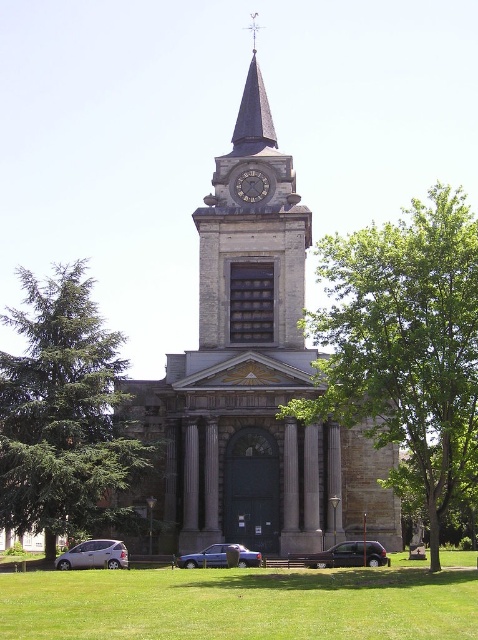
Consider the image. You are standing in front of the church and notice two points marked on the tower. Which point, point (377, 541) or point (241, 550), is closer to you?

Point (377, 541) is closer to you because it is further to the viewer than point (241, 550).

You are standing in front of the church and see both the metallic silver van at center and the matte blue sedan at center. Which vehicle is nearer to you?

The metallic silver van at center is closer to the viewer than the matte blue sedan at center.

You are driving a car and want to park in the parking lot near the church. You see a metallic silver van at center and a silver metallic hatchback at lower left. Which vehicle is closer to the entrance of the church?

The metallic silver van at center is closer to the entrance of the church because it is positioned below the silver metallic hatchback at lower left, meaning it is nearer to the front of the building.